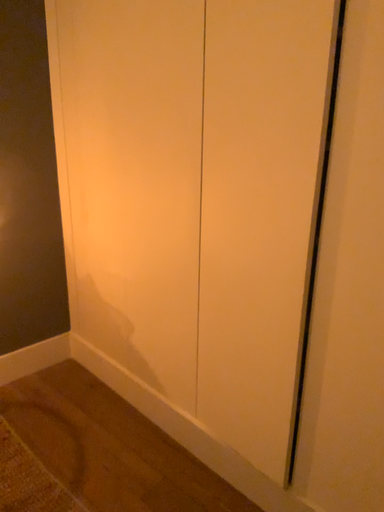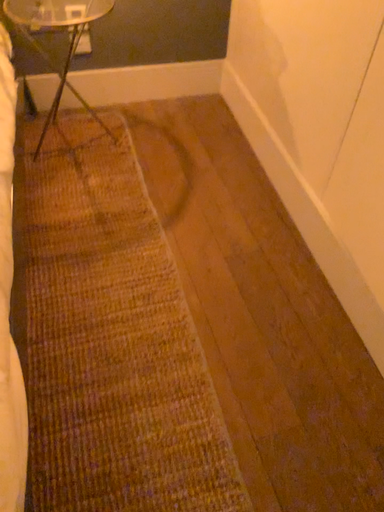
Question: Which way did the camera rotate in the video?

Choices:
 (A) rotated right
 (B) rotated left

Answer: (B)